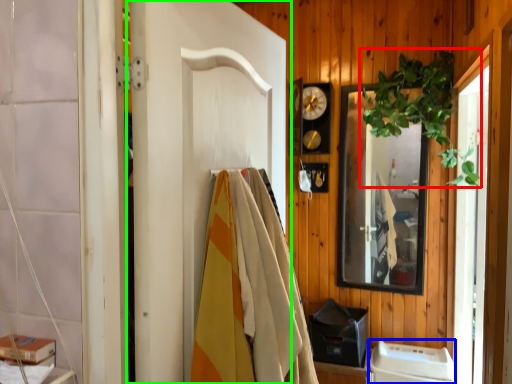
Question: Which object is the farthest from plant (highlighted by a red box)? Choose among these: appliance (highlighted by a blue box) or door (highlighted by a green box).

Choices:
 (A) appliance
 (B) door

Answer: (B)